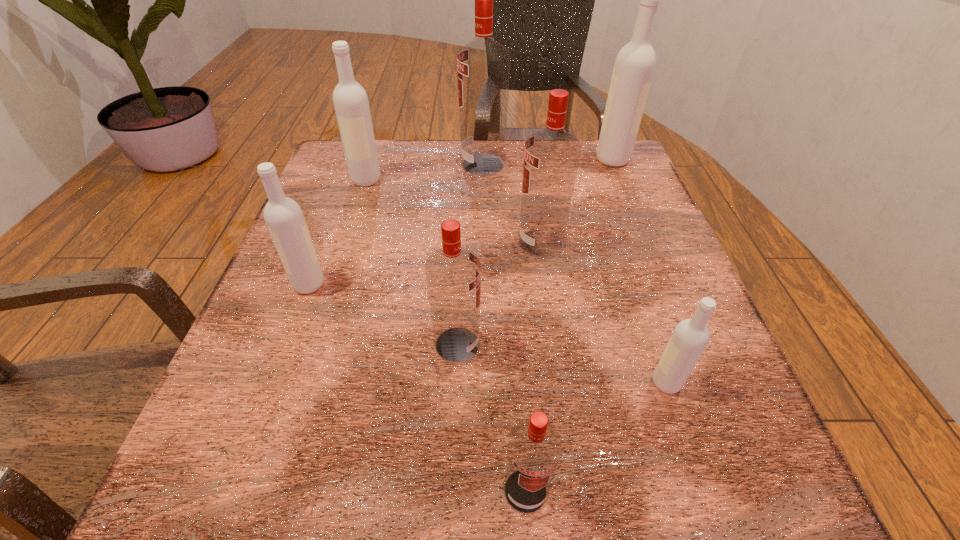
Find the location of a particular element. This screenshot has height=540, width=960. the farthest red vodka is located at coordinates (483, 66).

Locate an element on the screen. Image resolution: width=960 pixels, height=540 pixels. the farthest white vodka is located at coordinates (634, 66).

Find the location of `the third smallest red vodka`. the third smallest red vodka is located at coordinates (551, 156).

The height and width of the screenshot is (540, 960). I want to click on the fourth farthest object, so click(551, 156).

Locate an element on the screen. The image size is (960, 540). the third nearest white vodka is located at coordinates (350, 100).

Find the location of `the second smallest white vodka`. the second smallest white vodka is located at coordinates (283, 216).

Image resolution: width=960 pixels, height=540 pixels. I want to click on the second nearest white vodka, so click(283, 216).

This screenshot has width=960, height=540. I want to click on the third nearest object, so click(453, 274).

Find the location of a particular element. Image resolution: width=960 pixels, height=540 pixels. the sixth farthest vodka is located at coordinates (453, 274).

Find the location of a particular element. This screenshot has width=960, height=540. the second nearest object is located at coordinates (690, 337).